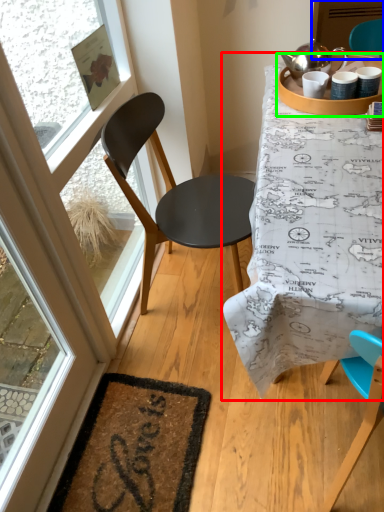
Question: Which object is positioned farthest from table (highlighted by a red box)? Select from screen door (highlighted by a blue box) and round table (highlighted by a green box).

Choices:
 (A) screen door
 (B) round table

Answer: (A)